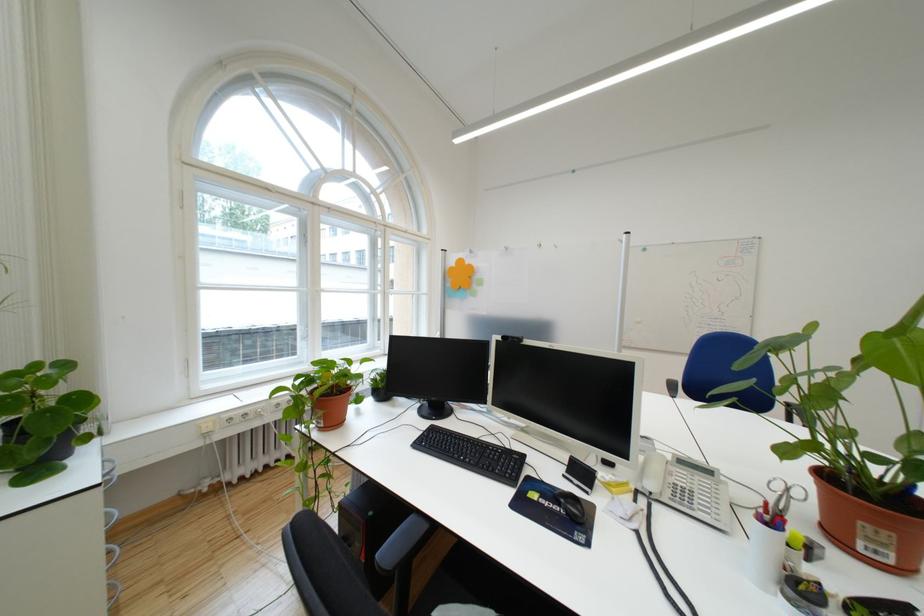
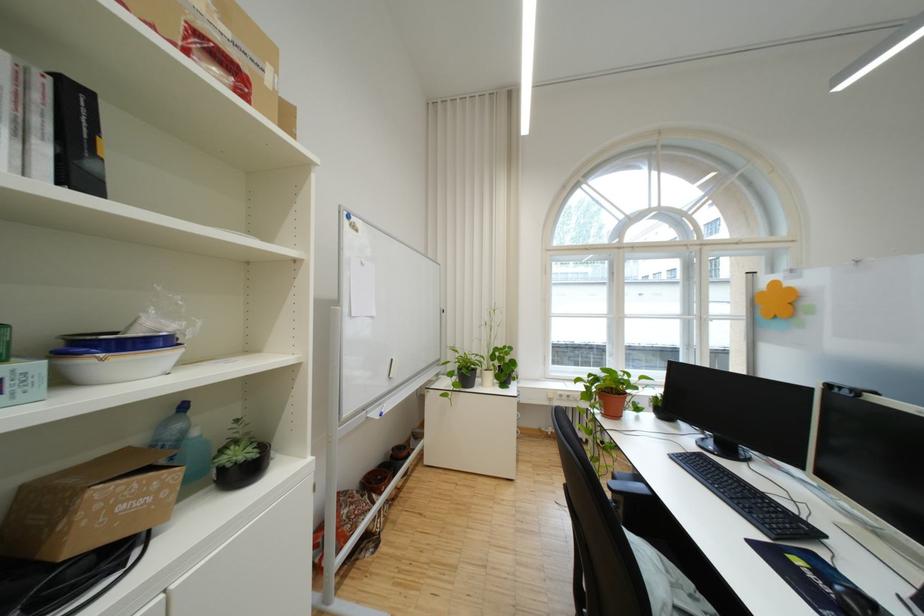
Find the pixel in the second image that matches point (361, 363) in the first image.

(640, 377)